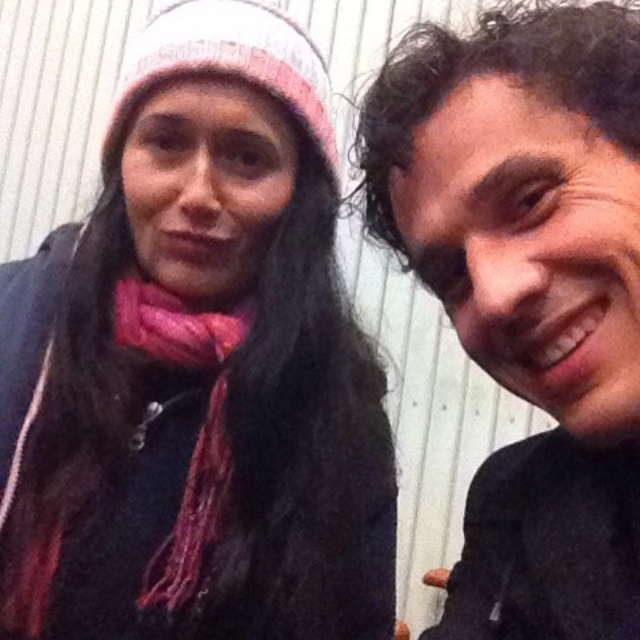
You are a photographer trying to focus on the matte black shirt at right in the image. What are the coordinates where you should aim your camera?

The coordinates for the matte black shirt at right are at point (529, 291).

You are a photographer trying to capture a closeup of the pink knitted scarf at left and the matte black shirt at right. Since you can only focus on one object at a time, which one should you choose to ensure it appears sharp in the photo?

The matte black shirt at right is larger in size than the pink knitted scarf at left, so focusing on the matte black shirt at right would ensure it appears sharp in the photo.